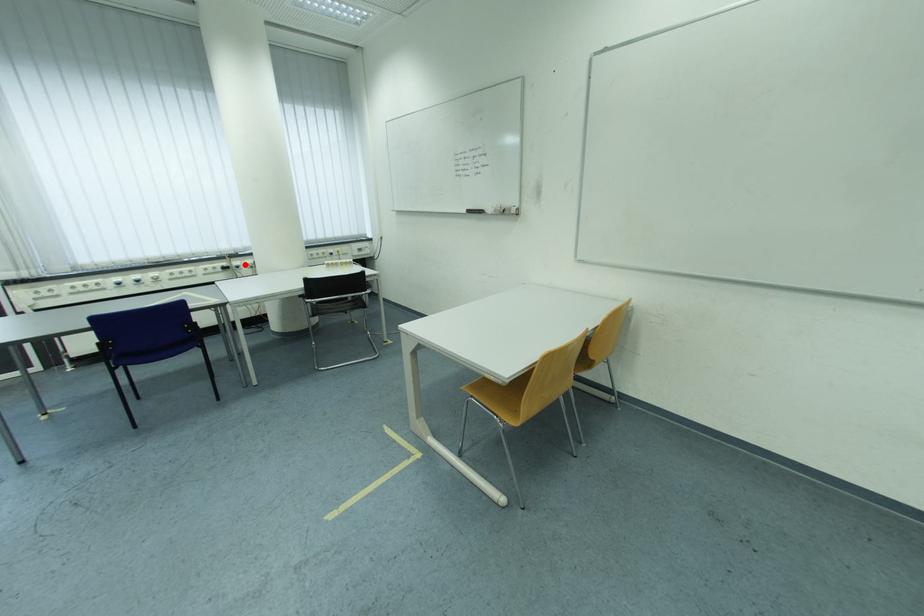
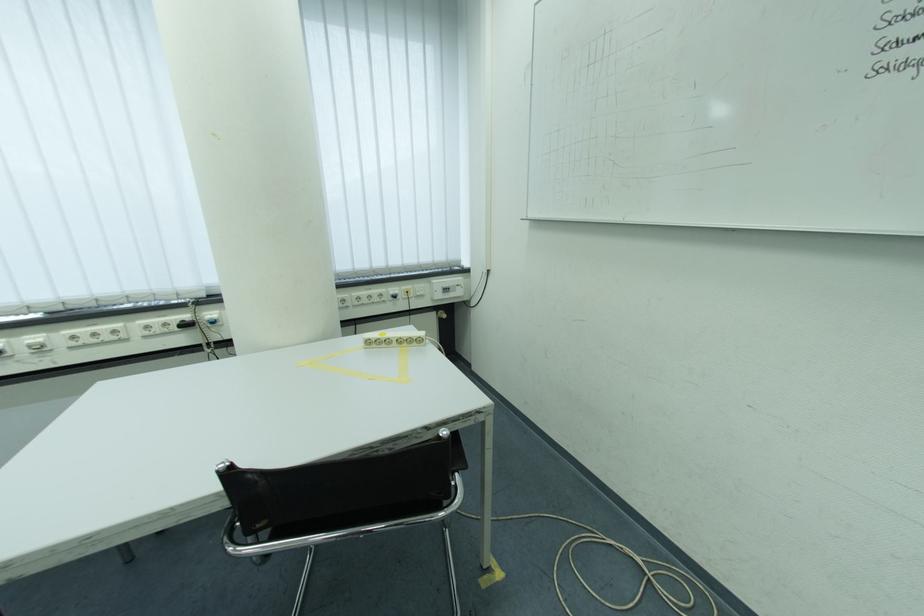
Question: I am providing you with two images of the same scene from different viewpoints. Given a red point in image1, look at the same physical point in image2. Is it:

Choices:
 (A) Closer to the viewpoint
 (B) Farther from the viewpoint

Answer: (B)